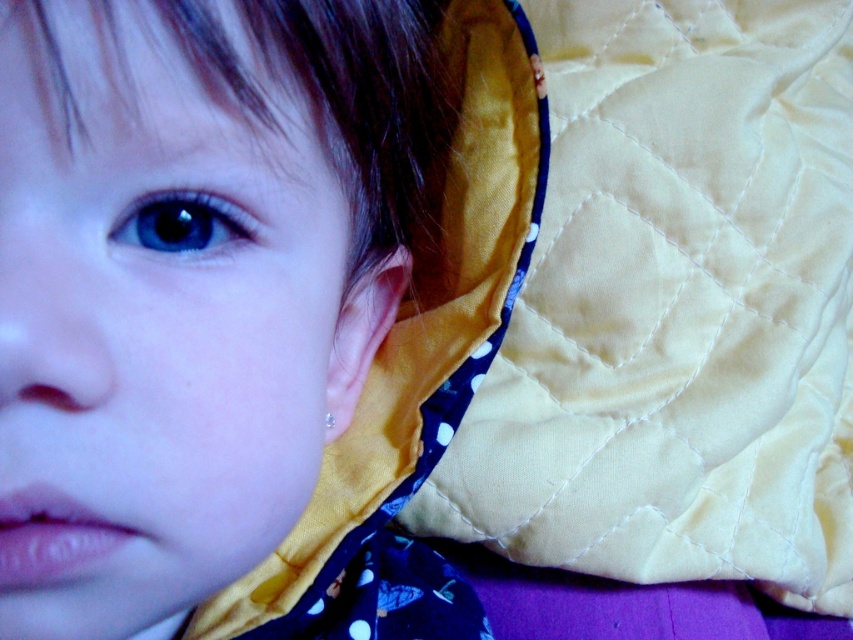
You are an artist painting this scene. You need to decide which object to paint first based on their sizes. Which object should you start with, the matte yellow fabric at upper left or the blue glossy eye at upper left?

The matte yellow fabric at upper left is wider than the blue glossy eye at upper left, so you should start painting the matte yellow fabric at upper left first as it is larger in width.

You are an interior designer looking at this image to choose fabrics for a nursery. You see the yellow quilted fabric at upper right and the matte yellow fabric at upper left. Which fabric is positioned higher in the image?

The yellow quilted fabric at upper right is located above the matte yellow fabric at upper left, so it is positioned higher in the image.

You are an artist sketching this scene. You need to decide which object to draw first based on size. Which one should you start with, the matte yellow fabric at upper left or the blue glossy eye at upper left?

The matte yellow fabric at upper left is bigger than the blue glossy eye at upper left, so you should start with the matte yellow fabric at upper left.